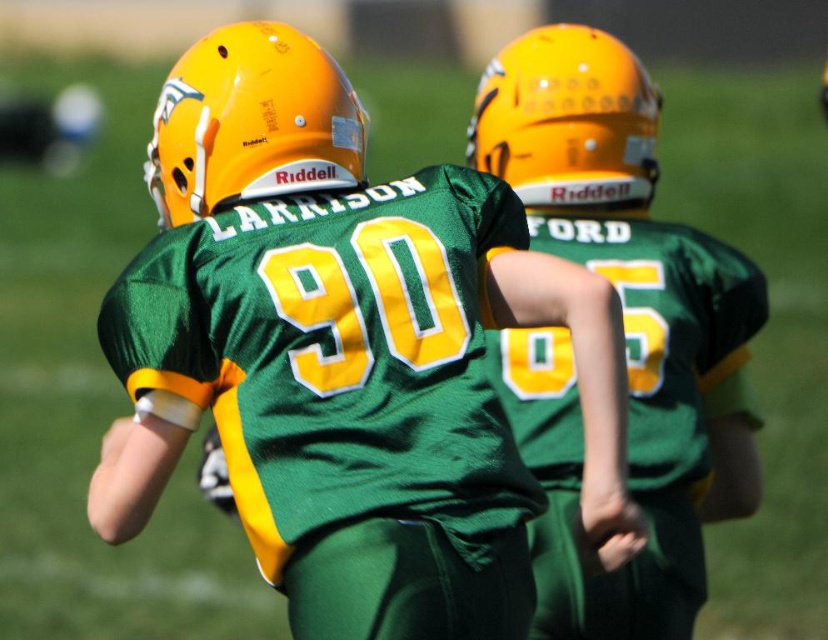
Question: Does matte yellow helmet at upper center appear on the right side of matte orange helmet at upper center?

Choices:
 (A) yes
 (B) no

Answer: (B)

Question: Can you confirm if matte yellow helmet at upper center is positioned to the right of matte orange helmet at upper center?

Choices:
 (A) no
 (B) yes

Answer: (A)

Question: Which is farther from the matte green jersey at center?

Choices:
 (A) matte yellow helmet at upper center
 (B) matte orange helmet at upper center

Answer: (A)

Question: Which point is closer to the camera?

Choices:
 (A) (333, 120)
 (B) (484, 81)
 (C) (624, 579)

Answer: (A)

Question: Which object is farther from the camera taking this photo?

Choices:
 (A) matte green jersey at center
 (B) matte orange helmet at upper center
 (C) matte yellow helmet at upper center

Answer: (B)

Question: Does matte yellow helmet at upper center have a larger size compared to matte orange helmet at upper center?

Choices:
 (A) no
 (B) yes

Answer: (A)